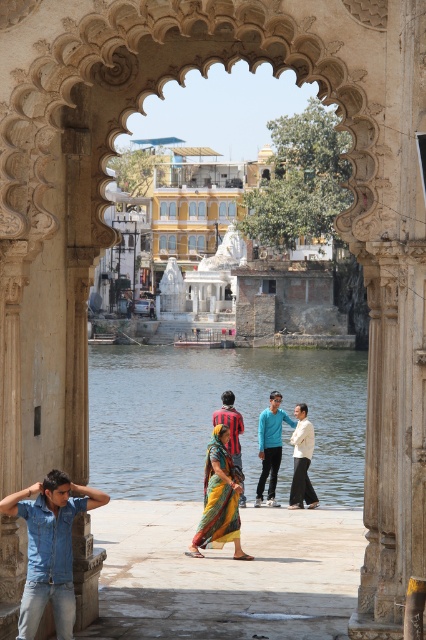
You are an interior designer observing the serene scene through the stone archway. You notice the yellow silk saree at center and the blue cotton shirt at center. Which clothing item appears shorter in height?

The yellow silk saree at center is not as tall as the blue cotton shirt at center, so the yellow silk saree at center appears shorter in height.

You are a fashion designer observing the scene. You notice the denim shirt at lower left and the vivid yellow sari at center. Which clothing item is narrower in width?

The denim shirt at lower left is narrower in width than the vivid yellow sari at center.